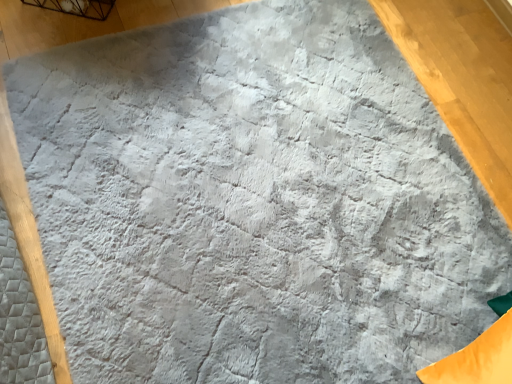
Question: Should I look upward or downward to see orange fabric bean bag chair at lower right?

Choices:
 (A) up
 (B) down

Answer: (B)